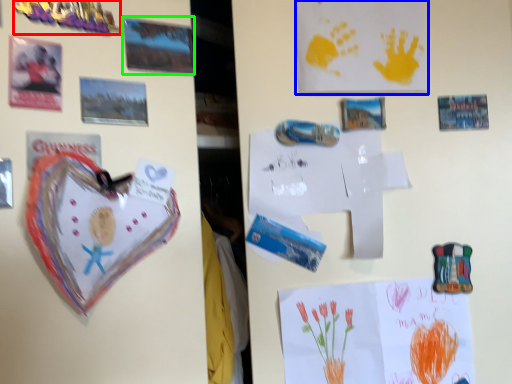
Question: Estimate the real-world distances between objects in this image. Which object is closer to toy (highlighted by a red box), postcard (highlighted by a blue box) or postcard (highlighted by a green box)?

Choices:
 (A) postcard
 (B) postcard

Answer: (B)